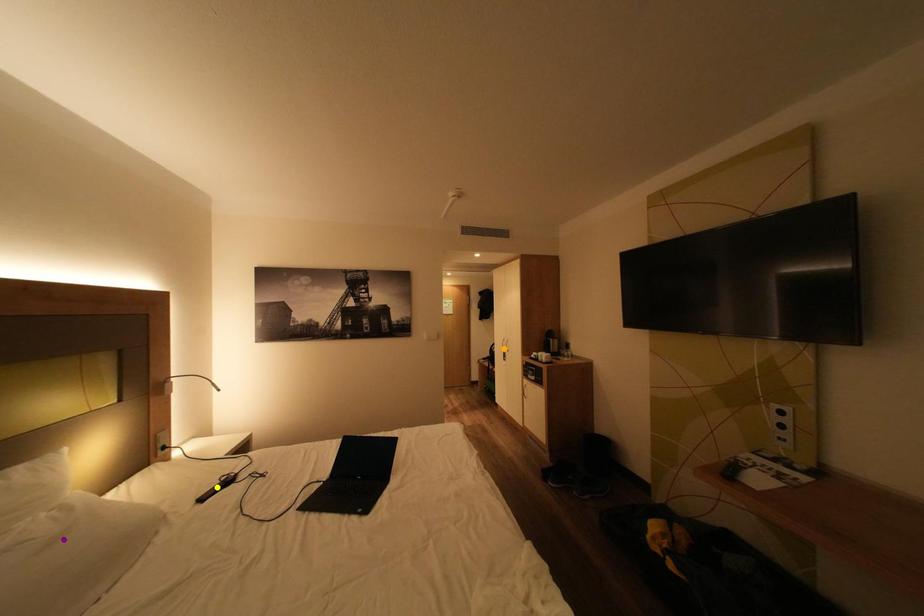
Order these from nearest to farthest:
- yellow point
- purple point
- orange point

purple point < yellow point < orange point